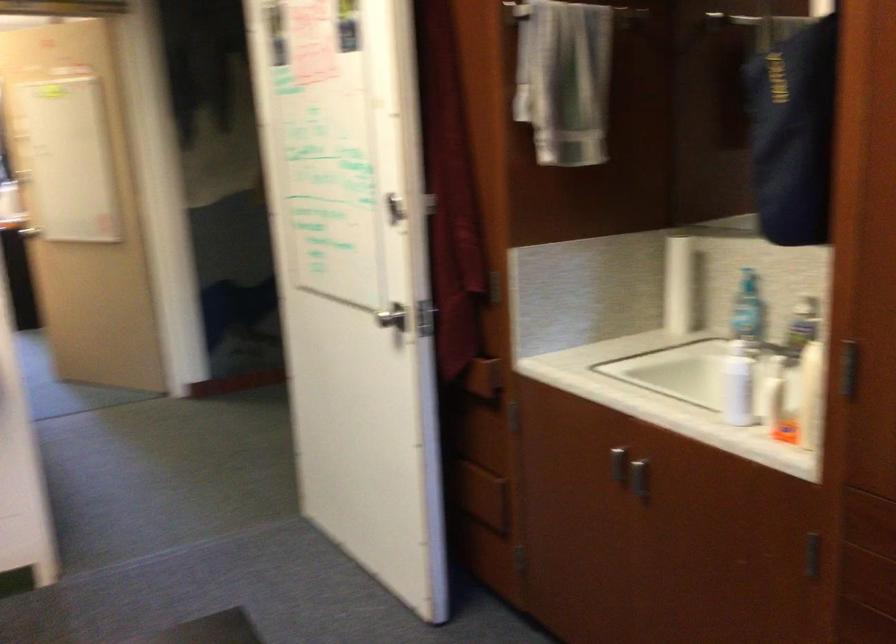
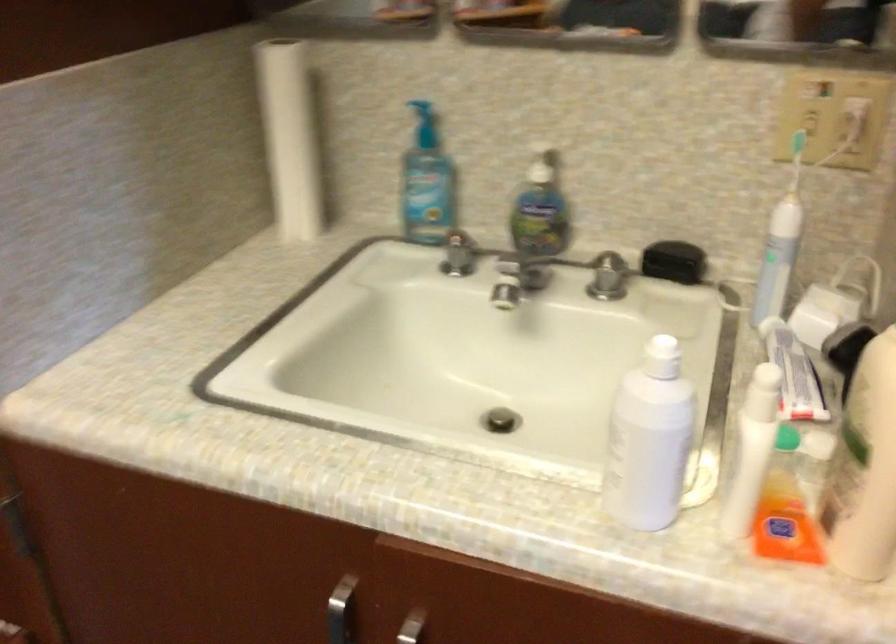
In the second image, find the point that corresponds to point (746, 268) in the first image.

(423, 109)